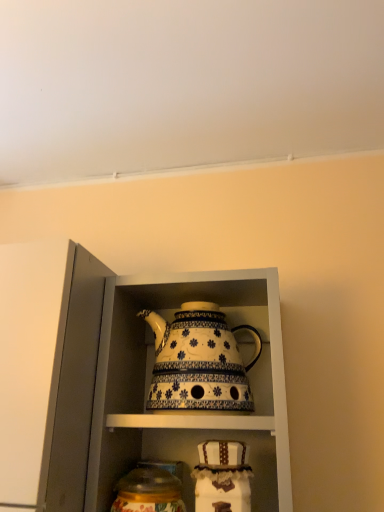
Question: Is white ceramic teapot at center bigger than white glossy teapot at center?

Choices:
 (A) yes
 (B) no

Answer: (B)

Question: Does white ceramic teapot at center lie behind white glossy teapot at center?

Choices:
 (A) yes
 (B) no

Answer: (A)

Question: From a real-world perspective, is white ceramic teapot at center beneath white glossy teapot at center?

Choices:
 (A) no
 (B) yes

Answer: (A)

Question: Can you confirm if white ceramic teapot at center is positioned to the right of white glossy teapot at center?

Choices:
 (A) yes
 (B) no

Answer: (B)

Question: From a real-world perspective, is white ceramic teapot at center positioned over white glossy teapot at center based on gravity?

Choices:
 (A) no
 (B) yes

Answer: (B)

Question: Considering the positions of white glossy teapot at center and matte glass jar at lower center in the image, is white glossy teapot at center wider or thinner than matte glass jar at lower center?

Choices:
 (A) wide
 (B) thin

Answer: (A)

Question: In terms of height, does white glossy teapot at center look taller or shorter compared to matte glass jar at lower center?

Choices:
 (A) short
 (B) tall

Answer: (B)

Question: Is point (100, 403) positioned closer to the camera than point (155, 471)?

Choices:
 (A) closer
 (B) farther

Answer: (A)

Question: Choose the correct answer: Is white glossy teapot at center inside matte glass jar at lower center or outside it?

Choices:
 (A) outside
 (B) inside

Answer: (A)

Question: Visually, is matte glass jar at lower center positioned to the left or to the right of white glossy teapot at center?

Choices:
 (A) left
 (B) right

Answer: (A)

Question: Considering their positions, is matte glass jar at lower center located in front of or behind white glossy teapot at center?

Choices:
 (A) behind
 (B) front

Answer: (A)

Question: Considering the positions of matte glass jar at lower center and white glossy teapot at center in the image, is matte glass jar at lower center wider or thinner than white glossy teapot at center?

Choices:
 (A) thin
 (B) wide

Answer: (A)

Question: Does point (173, 500) appear closer or farther from the camera than point (241, 434)?

Choices:
 (A) closer
 (B) farther

Answer: (A)

Question: From the image's perspective, is white ceramic teapot at center positioned above or below white glossy teapot at center?

Choices:
 (A) below
 (B) above

Answer: (B)

Question: Considering the positions of white ceramic teapot at center and white glossy teapot at center in the image, is white ceramic teapot at center wider or thinner than white glossy teapot at center?

Choices:
 (A) wide
 (B) thin

Answer: (B)